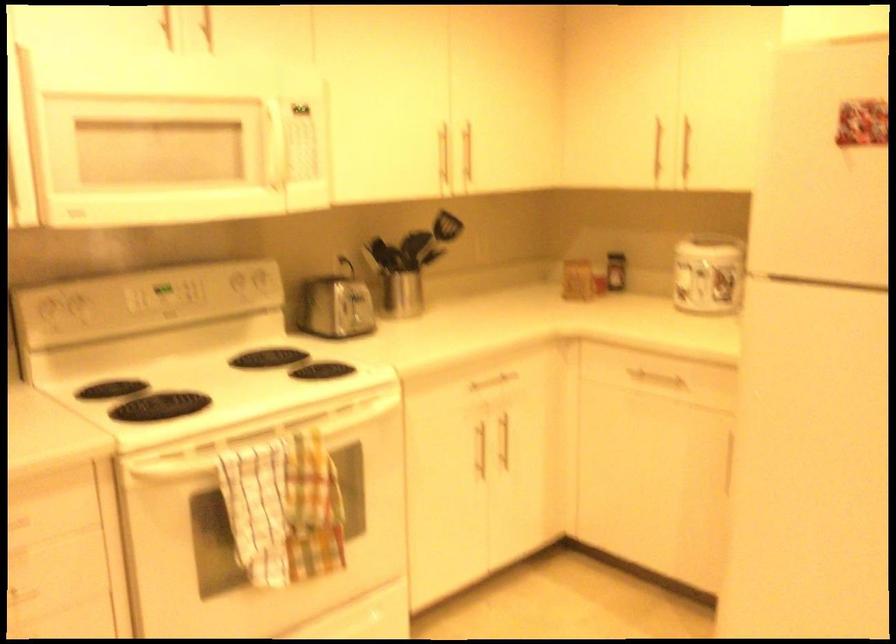
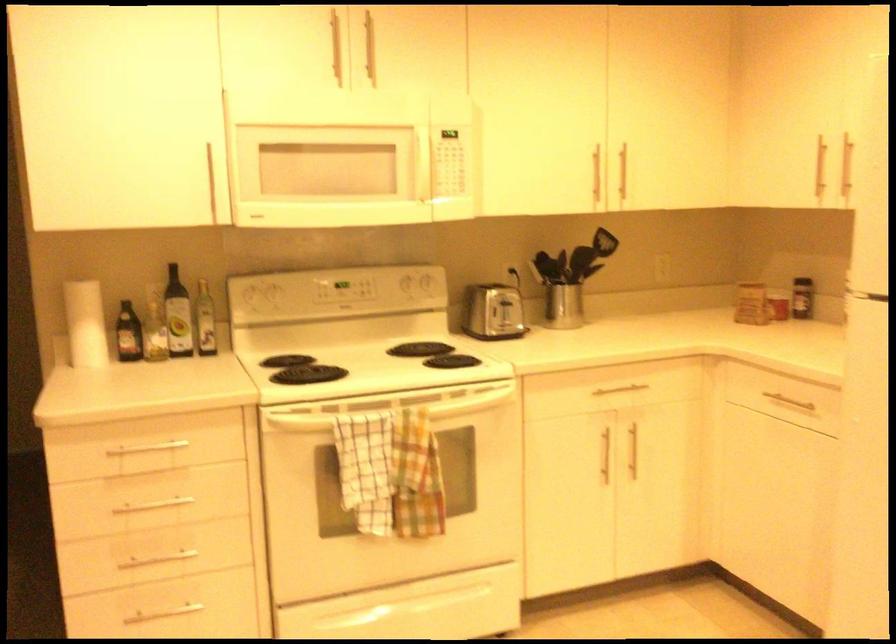
Question: The images are taken continuously from a first-person perspective. In which direction are you moving?

Choices:
 (A) Left
 (B) Right
 (C) Forward
 (D) Backward

Answer: (B)